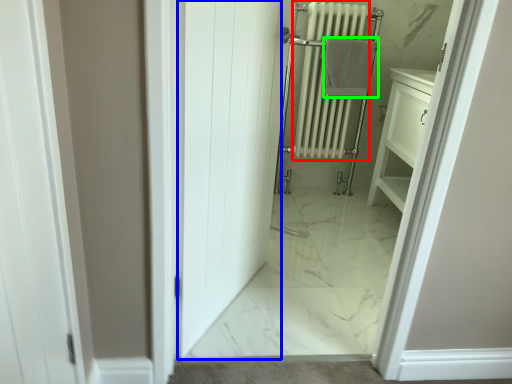
Question: Which is farther away from radiator (highlighted by a red box)? door (highlighted by a blue box) or bath towel (highlighted by a green box)?

Choices:
 (A) door
 (B) bath towel

Answer: (A)